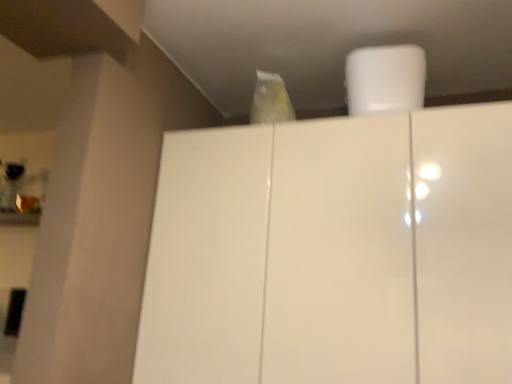
Question: Is glossy white cupboard at center in front of or behind white matte paper towel at upper center in the image?

Choices:
 (A) front
 (B) behind

Answer: (A)

Question: From the image's perspective, is glossy white cupboard at center above or below white matte paper towel at upper center?

Choices:
 (A) below
 (B) above

Answer: (A)

Question: Considering the positions of point (227, 170) and point (395, 104), is point (227, 170) closer or farther from the camera than point (395, 104)?

Choices:
 (A) closer
 (B) farther

Answer: (B)

Question: Is white matte paper towel at upper center spatially inside glossy white cupboard at center, or outside of it?

Choices:
 (A) outside
 (B) inside

Answer: (A)

Question: Is white matte paper towel at upper center bigger or smaller than glossy white cupboard at center?

Choices:
 (A) small
 (B) big

Answer: (A)

Question: Considering the positions of white matte paper towel at upper center and glossy white cupboard at center in the image, is white matte paper towel at upper center wider or thinner than glossy white cupboard at center?

Choices:
 (A) wide
 (B) thin

Answer: (B)

Question: Is point (371, 91) positioned closer to the camera than point (322, 254)?

Choices:
 (A) farther
 (B) closer

Answer: (A)